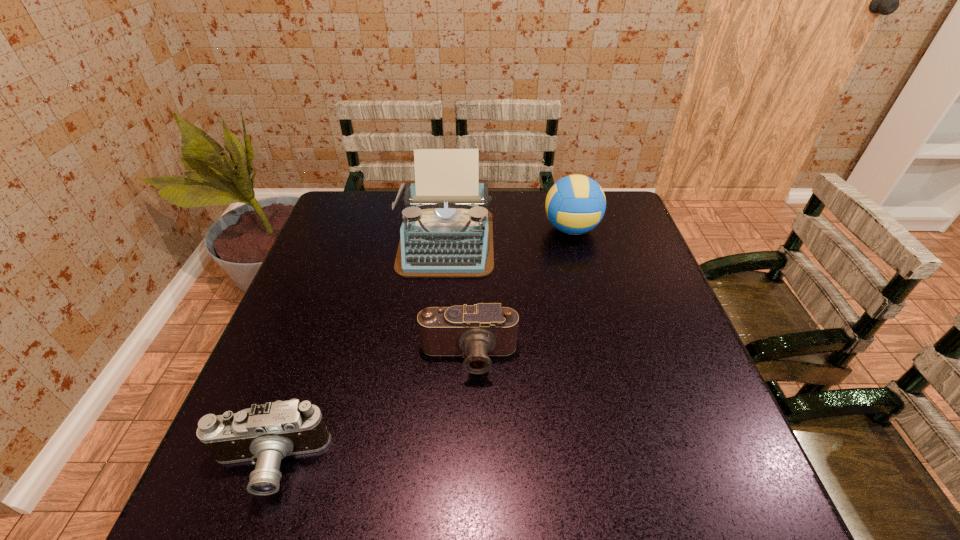
Locate an element on the screen. The width and height of the screenshot is (960, 540). typewriter is located at coordinates [x=447, y=231].

Find the location of a particular element. The image size is (960, 540). the second tallest object is located at coordinates pyautogui.click(x=575, y=204).

You are a GUI agent. You are given a task and a screenshot of the screen. Output one action in this format:
    pyautogui.click(x=<x>, y=<y>)
    Task: Click on the rightmost object
    The width and height of the screenshot is (960, 540).
    Given the screenshot: What is the action you would take?
    pyautogui.click(x=575, y=204)

Where is `the right camera`? The width and height of the screenshot is (960, 540). the right camera is located at coordinates (486, 329).

Find the location of a particular element. The width and height of the screenshot is (960, 540). the farther camera is located at coordinates (486, 329).

At what (x,y) coordinates should I click in order to perform the action: click on the leftmost object. Please return your answer as a coordinate pair (x, y). The image size is (960, 540). Looking at the image, I should click on (264, 434).

Identify the location of the left camera. The width and height of the screenshot is (960, 540). (264, 434).

Find the location of `vacant region located on the typing side of the tallest object`. vacant region located on the typing side of the tallest object is located at coordinates (436, 334).

Identify the location of free space located on the back of the volleyball. This screenshot has width=960, height=540. 564,201.

The height and width of the screenshot is (540, 960). In order to click on free region located 0.240m on the front-facing side of the second nearest object in this screenshot , I will do `click(466, 497)`.